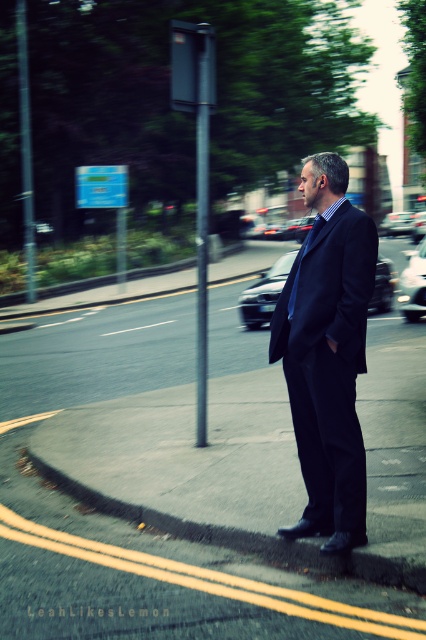
You are a pedestrian crossing the street and see the concrete at lower right and the metallic silver car at center. Which object is closer to your left side?

The concrete at lower right is to the left of metallic silver car at center, so it is closer to your left side.

Where is the dark blue suit at center located in the image?

The dark blue suit at center is located at point coordinates of [328,355].

You are a delivery drone operator. Your drone is currently at a point 5.41 meters away from the camera. You need to deliver a package to the point labeled as point (158, 528). Is your current position correct for the delivery?

Yes, the point (158, 528) is exactly 5.41 meters away from the camera, so your current position is correct for the delivery.